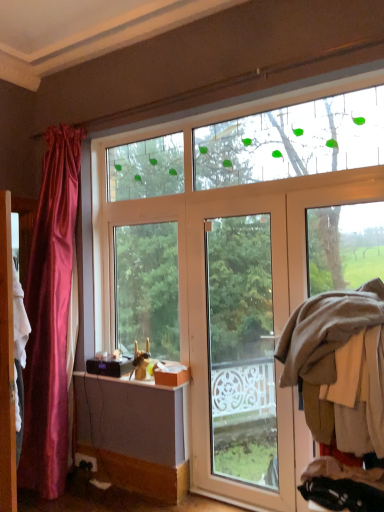
Question: Can you confirm if brown woolen sweater at right is shorter than white glossy door at center?

Choices:
 (A) no
 (B) yes

Answer: (B)

Question: From a real-world perspective, is brown woolen sweater at right physically below white glossy door at center?

Choices:
 (A) yes
 (B) no

Answer: (B)

Question: Can you confirm if brown woolen sweater at right is positioned to the right of white glossy door at center?

Choices:
 (A) yes
 (B) no

Answer: (A)

Question: Is the depth of brown woolen sweater at right greater than that of white glossy door at center?

Choices:
 (A) no
 (B) yes

Answer: (A)

Question: Could white glossy door at center be considered to be inside brown woolen sweater at right?

Choices:
 (A) no
 (B) yes

Answer: (A)

Question: Is brown woolen sweater at right taller than white glossy door at center?

Choices:
 (A) no
 (B) yes

Answer: (A)

Question: Is wooden screen door at left at the right side of white glossy door at center?

Choices:
 (A) no
 (B) yes

Answer: (A)

Question: Considering the relative sizes of wooden screen door at left and white glossy door at center in the image provided, is wooden screen door at left wider than white glossy door at center?

Choices:
 (A) no
 (B) yes

Answer: (B)

Question: Considering the relative sizes of wooden screen door at left and white glossy door at center in the image provided, is wooden screen door at left bigger than white glossy door at center?

Choices:
 (A) yes
 (B) no

Answer: (B)

Question: Is wooden screen door at left not close to white glossy door at center?

Choices:
 (A) yes
 (B) no

Answer: (A)

Question: Is the depth of wooden screen door at left less than that of white glossy door at center?

Choices:
 (A) no
 (B) yes

Answer: (B)

Question: Does wooden screen door at left lie behind white glossy door at center?

Choices:
 (A) no
 (B) yes

Answer: (A)

Question: From a real-world perspective, is wooden screen door at left positioned under brown woolen sweater at right based on gravity?

Choices:
 (A) no
 (B) yes

Answer: (B)